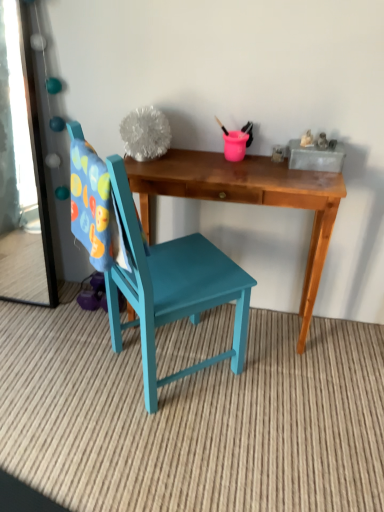
Identify the location of vacant space in front of wooden desk at center. (236, 430).